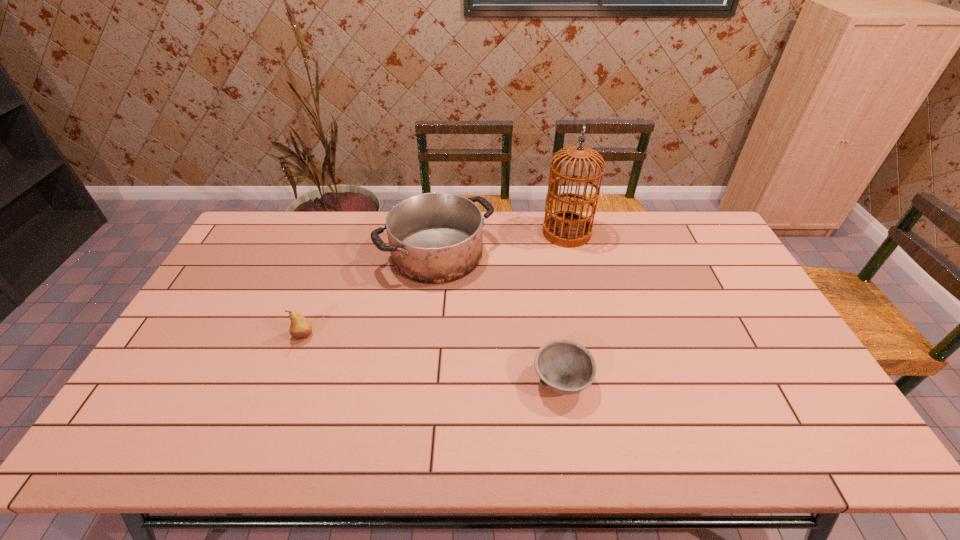
You are a GUI agent. You are given a task and a screenshot of the screen. Output one action in this format:
    pyautogui.click(x=<x>, y=<y>)
    Task: Click on the blank region between the second object from left to right and the nearest object
    
    Given the screenshot: What is the action you would take?
    pyautogui.click(x=499, y=318)

The image size is (960, 540). Find the location of `unoccupied area between the third object from right to left and the pear`. unoccupied area between the third object from right to left and the pear is located at coordinates coord(371,295).

Image resolution: width=960 pixels, height=540 pixels. I want to click on vacant area that lies between the shortest object and the tallest object, so click(x=564, y=307).

This screenshot has height=540, width=960. In order to click on vacant area between the saucepan and the birdcage in this screenshot , I will do `click(502, 243)`.

You are a GUI agent. You are given a task and a screenshot of the screen. Output one action in this format:
    pyautogui.click(x=<x>, y=<y>)
    Task: Click on the object identified as the closest to the third object from right to left
    The width and height of the screenshot is (960, 540).
    Given the screenshot: What is the action you would take?
    pyautogui.click(x=569, y=229)

I want to click on the third closest object to the birdcage, so click(x=300, y=328).

Find the location of a particular element. Image resolution: width=960 pixels, height=540 pixels. vacant space that satisfies the following two spatial constraints: 1. on the back side of the pear; 2. on the right side of the saucepan is located at coordinates (334, 254).